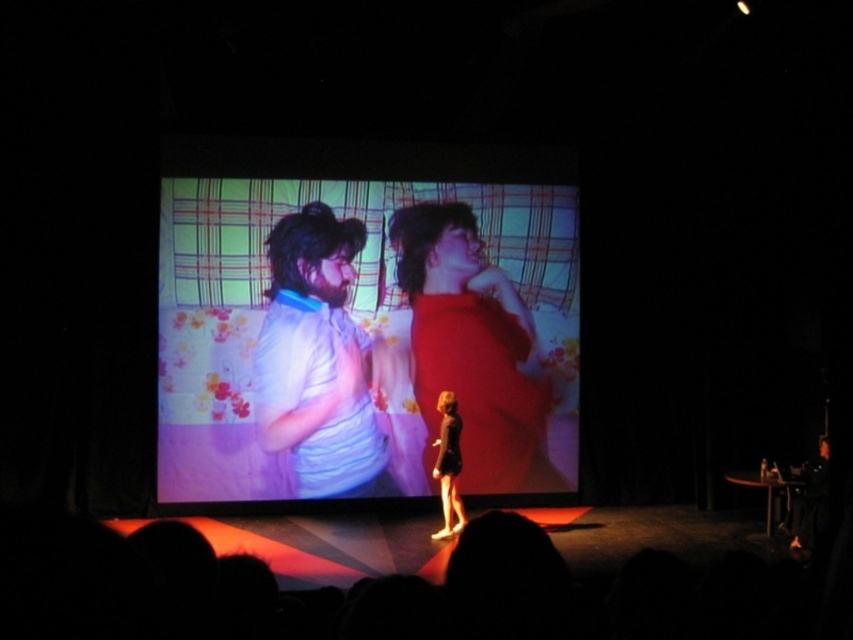
Question: Is matte fabric screen at center below matte red dress at center?

Choices:
 (A) yes
 (B) no

Answer: (B)

Question: Observing the image, what is the correct spatial positioning of light blue fabric shirt at center in reference to black satin dress at center?

Choices:
 (A) above
 (B) below

Answer: (A)

Question: Which of the following is the farthest from the observer?

Choices:
 (A) light blue fabric shirt at center
 (B) black satin dress at center
 (C) matte red dress at center
 (D) matte fabric screen at center

Answer: (C)

Question: Is matte red dress at center further to camera compared to black satin dress at center?

Choices:
 (A) yes
 (B) no

Answer: (A)

Question: Which point is closer to the camera?

Choices:
 (A) matte fabric screen at center
 (B) light blue fabric shirt at center
 (C) black satin dress at center
 (D) matte red dress at center

Answer: (C)

Question: Among these points, which one is nearest to the camera?

Choices:
 (A) (465, 518)
 (B) (418, 216)
 (C) (315, 416)
 (D) (413, 292)

Answer: (A)